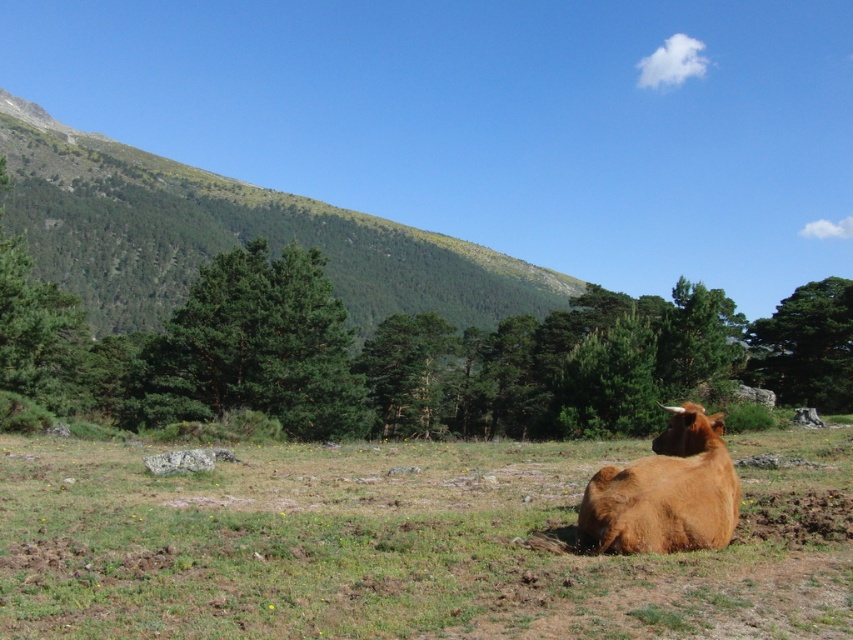
You are standing in the middle of the field looking towards the brown furry bull at lower right. Which direction should you walk to reach the green grassy hillside at upper left?

Since the green grassy hillside at upper left is positioned on the left side of the brown furry bull at lower right, you should walk towards the left direction to reach it.

You are a farmer checking the field. You need to know if the brown grassy field at center can accommodate the brown furry bull at lower right in terms of width. Can it?

The brown grassy field at center is wider than the brown furry bull at lower right, so yes, the field can accommodate the bull in terms of width.

You are standing in the foreground of the image where the brown cow is lying. Looking towards the upper left corner of the image, can you see the green grassy hillside at upper left? Where is it positioned relative to your current location?

The green grassy hillside at upper left is located at point [228,236], which means it is positioned in the upper left area of the image, above and to the left of your current position in the foreground.